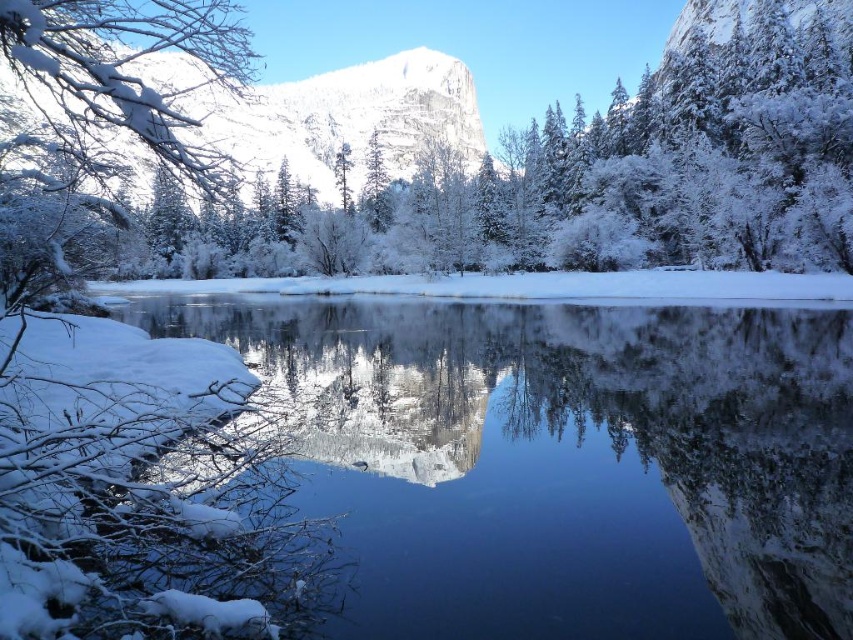
You are standing at the edge of the winter landscape and want to take a photo. There are two points marked in the image, point 1 at coordinates point (38, 208) and point 2 at coordinates point (344, 150). Which point is closer to you?

Point (38, 208) is closer to the camera than point (344, 150), so point 1 is closer to you.